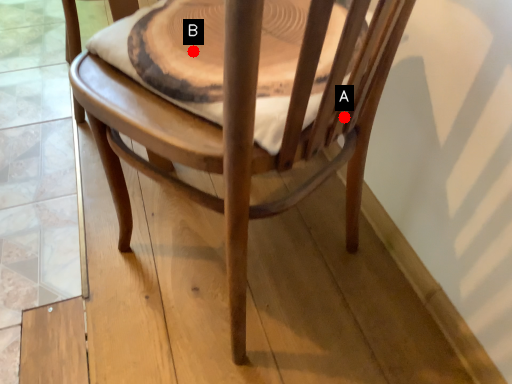
Question: Two points are circled on the image, labeled by A and B beside each circle. Which of the following is the closest to the observer?

Choices:
 (A) A is closer
 (B) B is closer

Answer: (A)